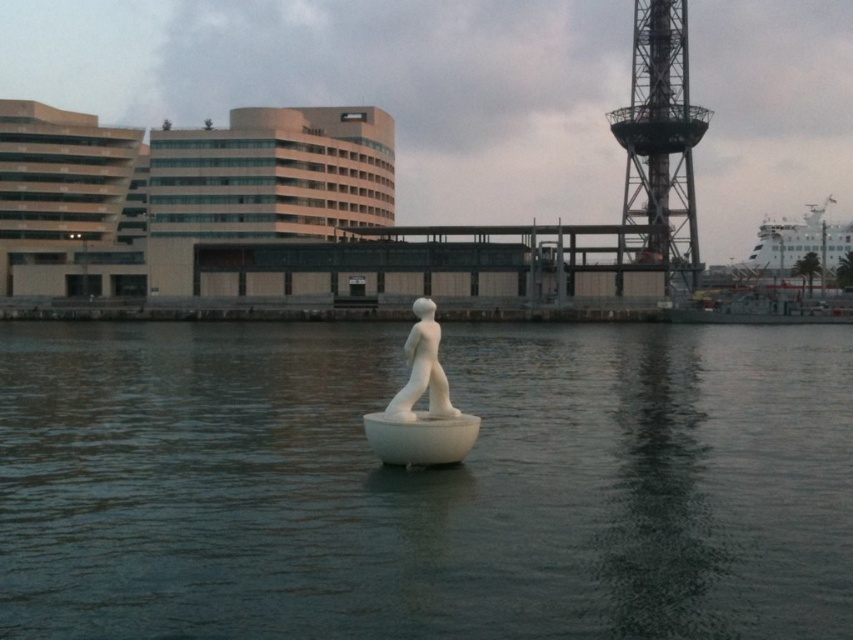
Question: Which of the following is the closest to the observer?

Choices:
 (A) (788, 228)
 (B) (456, 420)
 (C) (433, 344)

Answer: (B)

Question: Which of these objects is positioned closest to the white glossy ship at upper right?

Choices:
 (A) white matte water at center
 (B) metallic lattice tower at upper right
 (C) white glossy statue at center

Answer: (B)

Question: Does metallic lattice tower at upper right have a greater width compared to white glossy statue at center?

Choices:
 (A) yes
 (B) no

Answer: (A)

Question: Can you confirm if white matte water at center is bigger than white glossy ship at upper right?

Choices:
 (A) yes
 (B) no

Answer: (B)

Question: Can you confirm if metallic lattice tower at upper right is bigger than white glossy ship at upper right?

Choices:
 (A) yes
 (B) no

Answer: (A)

Question: Which point is farther to the camera?

Choices:
 (A) white glossy statue at center
 (B) white matte water at center
 (C) white matte sculpture at center

Answer: (C)